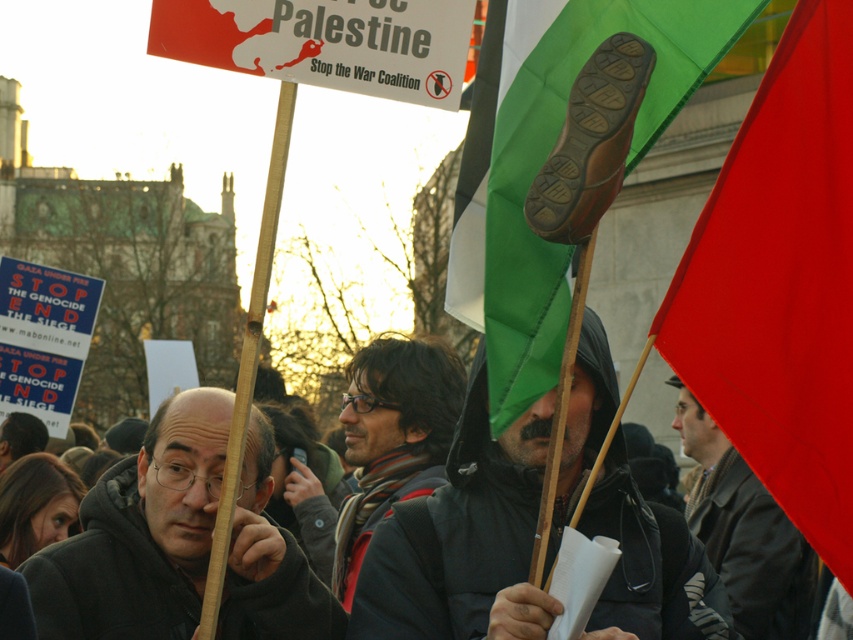
Is matte black hoodie at center bigger than dark gray scarf at center?

No.

Is point (218, 435) more distant than point (450, 436)?

No, (218, 435) is in front of (450, 436).

Who is more forward, (294, 544) or (440, 401)?

Positioned in front is point (294, 544).

This screenshot has height=640, width=853. Identify the location of matte black hoodie at center. (140, 532).

Is dark gray scarf at center closer to camera compared to brown wool coat at right?

No, dark gray scarf at center is behind brown wool coat at right.

Who is higher up, dark gray scarf at center or brown wool coat at right?

dark gray scarf at center is higher up.

Who is more distant from viewer, (416, 371) or (815, 582)?

The point (416, 371) is behind.

Locate an element on the screen. The height and width of the screenshot is (640, 853). dark gray scarf at center is located at coordinates (392, 436).

In the scene shown: Does black matte jacket at center have a greater height compared to matte black hoodie at center?

Yes, black matte jacket at center is taller than matte black hoodie at center.

Which is in front, point (416, 536) or point (165, 579)?

Point (416, 536)

The image size is (853, 640). What do you see at coordinates (457, 531) in the screenshot?
I see `black matte jacket at center` at bounding box center [457, 531].

I want to click on black matte jacket at center, so click(457, 531).